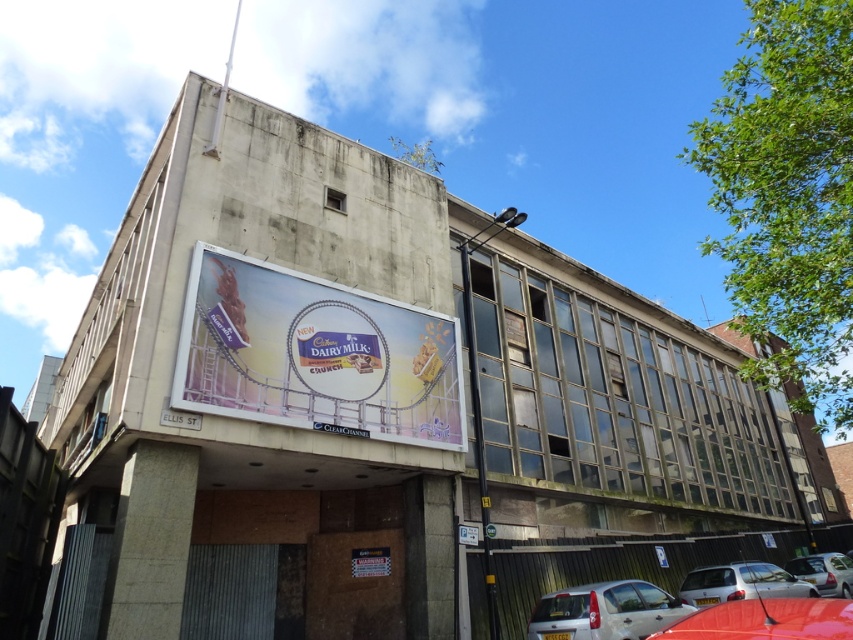
Question: Does white glossy billboard at center have a larger size compared to white glossy car at lower right?

Choices:
 (A) yes
 (B) no

Answer: (A)

Question: Does silver metallic car at lower right lie in front of white glossy car at lower right?

Choices:
 (A) yes
 (B) no

Answer: (A)

Question: Can you confirm if shiny red car at lower right is positioned to the left of silver metallic car at lower right?

Choices:
 (A) yes
 (B) no

Answer: (A)

Question: Which object appears closest to the camera in this image?

Choices:
 (A) silver metallic hatchback at lower center
 (B) white glossy car at lower right

Answer: (A)

Question: Based on their relative distances, which object is farther from the silver metallic car at lower right?

Choices:
 (A) white glossy billboard at center
 (B) silver metallic hatchback at lower center

Answer: (A)

Question: Which is farther from the white glossy car at lower right?

Choices:
 (A) shiny red car at lower right
 (B) white glossy billboard at center
 (C) silver metallic hatchback at lower center

Answer: (A)